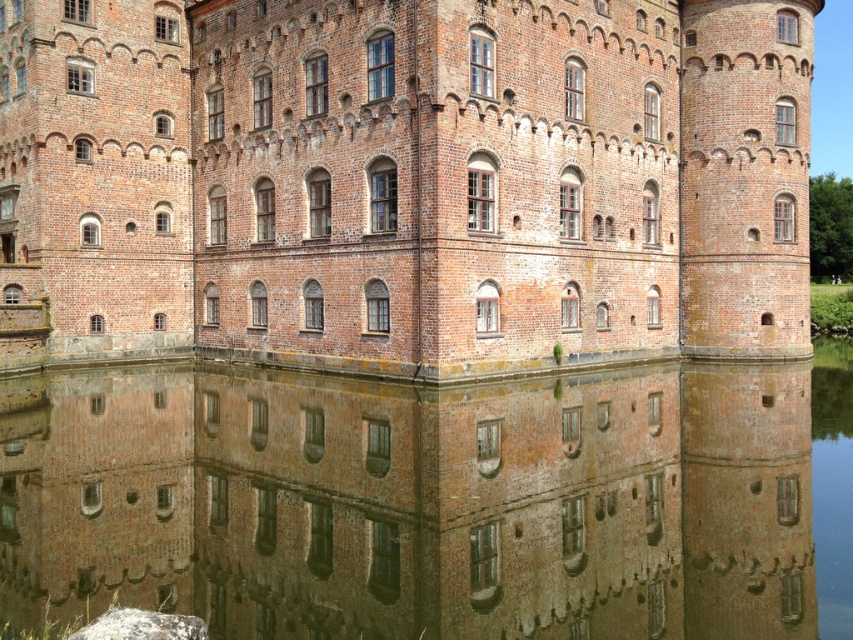
Question: Observing the image, what is the correct spatial positioning of brick wall at center in reference to brown reflective water at bottom?

Choices:
 (A) below
 (B) above

Answer: (B)

Question: Which object appears farthest from the camera in this image?

Choices:
 (A) brown reflective water at bottom
 (B) brick wall at center

Answer: (B)

Question: Which of the following is the farthest from the observer?

Choices:
 (A) brick wall at center
 (B) brown reflective water at bottom

Answer: (A)

Question: Is brick wall at center above brown reflective water at bottom?

Choices:
 (A) yes
 (B) no

Answer: (A)

Question: Which of the following is the farthest from the observer?

Choices:
 (A) (556, 486)
 (B) (685, 202)

Answer: (B)

Question: Is brick wall at center bigger than brown reflective water at bottom?

Choices:
 (A) no
 (B) yes

Answer: (B)